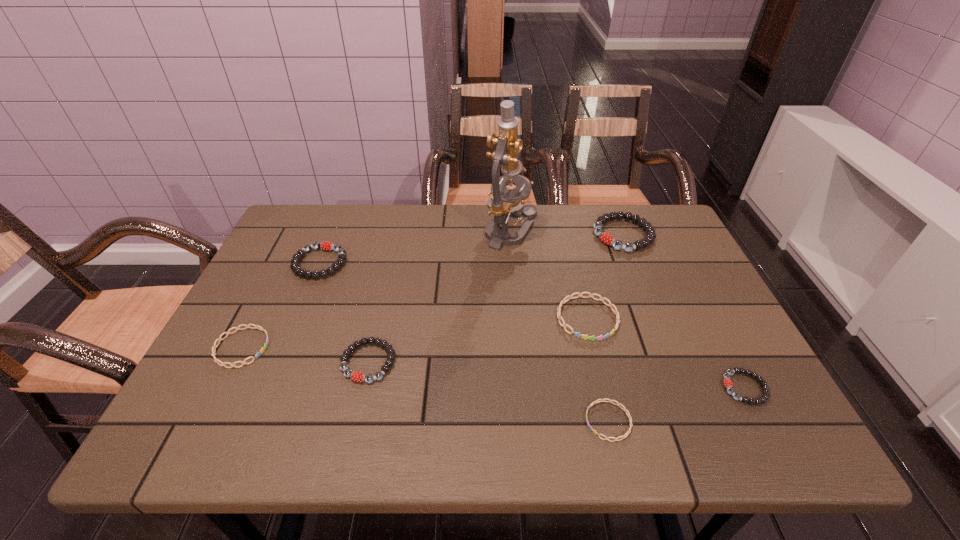
At what (x,y) coordinates should I click in order to perform the action: click on vacant point at the far right corner. Please return your answer as a coordinate pair (x, y). The width and height of the screenshot is (960, 540). Looking at the image, I should click on (656, 227).

Locate an element on the screen. free space between the smallest black bracelet and the second biggest black bracelet is located at coordinates (533, 326).

Identify the location of blank region between the second biggest black bracelet and the shortest object. Image resolution: width=960 pixels, height=540 pixels. (465, 342).

Find the location of a particular element. This screenshot has height=540, width=960. free area in between the second tallest object and the biggest blue bracelet is located at coordinates (606, 276).

Locate an element on the screen. The width and height of the screenshot is (960, 540). free space between the microscope and the smallest black bracelet is located at coordinates (628, 310).

This screenshot has width=960, height=540. Identify the location of empty location between the leftmost blue bracelet and the seventh shortest object. (433, 291).

What are the coordinates of `free space that is in between the leftmost blue bracelet and the nearest blue bracelet` in the screenshot? It's located at (425, 384).

This screenshot has width=960, height=540. I want to click on free area in between the leftmost blue bracelet and the shortest object, so click(x=425, y=384).

Where is `free space between the biggest black bracelet and the third black bracelet from right to left`? This screenshot has width=960, height=540. free space between the biggest black bracelet and the third black bracelet from right to left is located at coordinates (496, 299).

Identify which object is located as the fourth nearest to the smallest black bracelet. Please provide its 2D coordinates. Your answer should be formatted as a tuple, i.e. [(x, y)], where the tuple contains the x and y coordinates of a point satisfying the conditions above.

[(504, 203)]